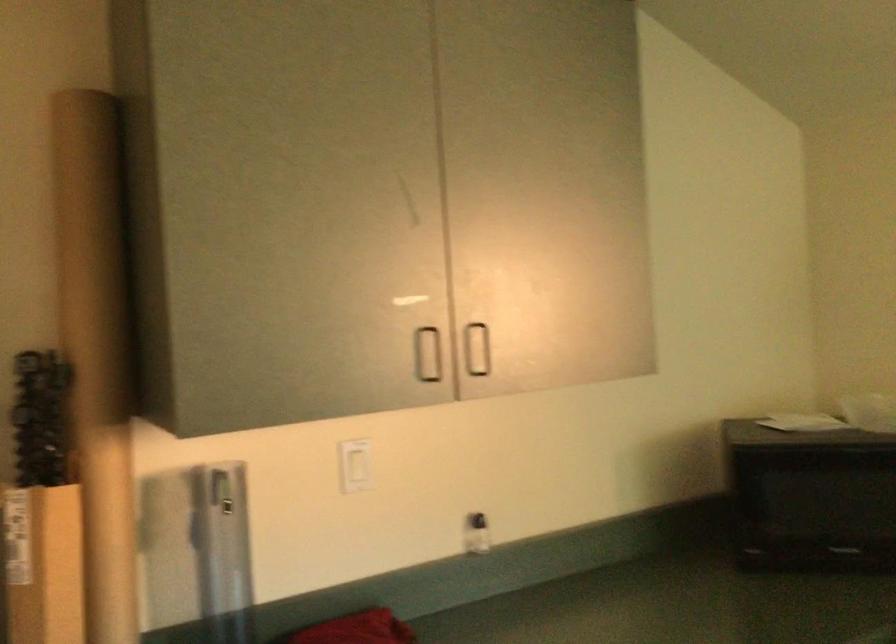
Question: How did the camera likely rotate?

Choices:
 (A) Left
 (B) Right
 (C) Up
 (D) Down

Answer: (A)